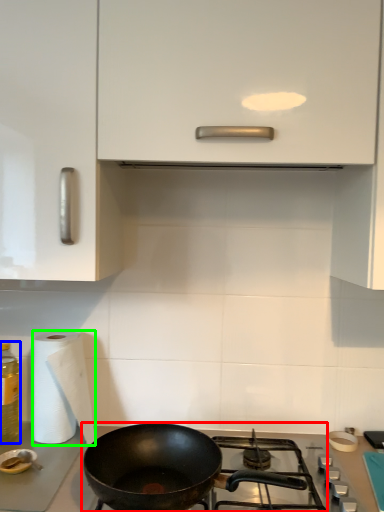
Question: Estimate the real-world distances between objects in this image. Which object is closer to gas stove (highlighted by a red box), bottle (highlighted by a blue box) or paper towel (highlighted by a green box)?

Choices:
 (A) bottle
 (B) paper towel

Answer: (B)